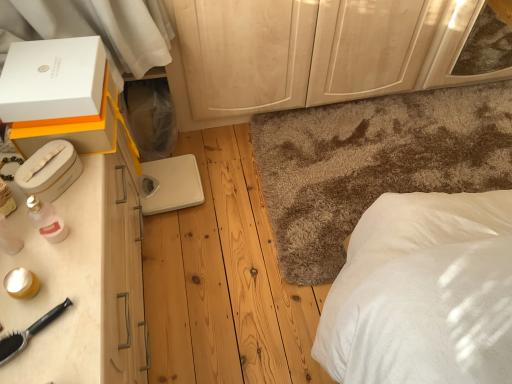
Image resolution: width=512 pixels, height=384 pixels. Find the location of `free area in between pink glass perfume at left and black plastic brush at lower left`. free area in between pink glass perfume at left and black plastic brush at lower left is located at coordinates (42, 273).